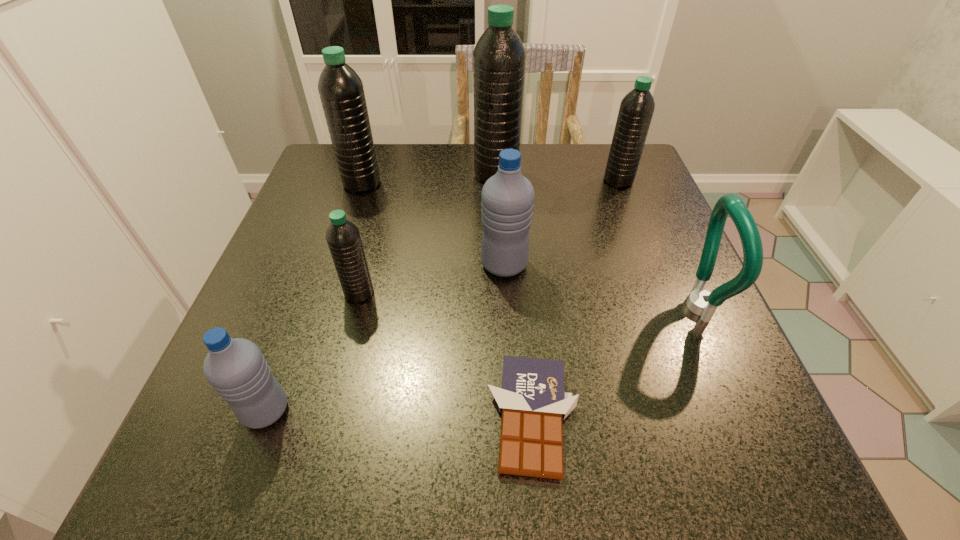
This screenshot has height=540, width=960. Find the location of `vacant space situated at the jaws of the green bottle opener`. vacant space situated at the jaws of the green bottle opener is located at coordinates (633, 307).

Find the location of `vacant area situated 0.260m on the back of the nearest black water bottle`. vacant area situated 0.260m on the back of the nearest black water bottle is located at coordinates (x=383, y=199).

Where is `blank space located 0.280m on the right of the left blue water bottle`? blank space located 0.280m on the right of the left blue water bottle is located at coordinates (481, 410).

Where is `vacant space located on the right of the shortest object`? vacant space located on the right of the shortest object is located at coordinates (668, 417).

Where is `water bottle that is at the near edge`? The height and width of the screenshot is (540, 960). water bottle that is at the near edge is located at coordinates (236, 368).

Find the location of a particular element. The width and height of the screenshot is (960, 540). chocolate bar at the near edge is located at coordinates (532, 399).

Locate an element on the screen. The height and width of the screenshot is (540, 960). water bottle that is at the right edge is located at coordinates (636, 109).

Where is `bottle opener that is positioned at the right edge`? This screenshot has width=960, height=540. bottle opener that is positioned at the right edge is located at coordinates (701, 302).

I want to click on object that is at the far left corner, so click(x=341, y=91).

In order to click on object present at the near left corner in this screenshot , I will do `click(236, 368)`.